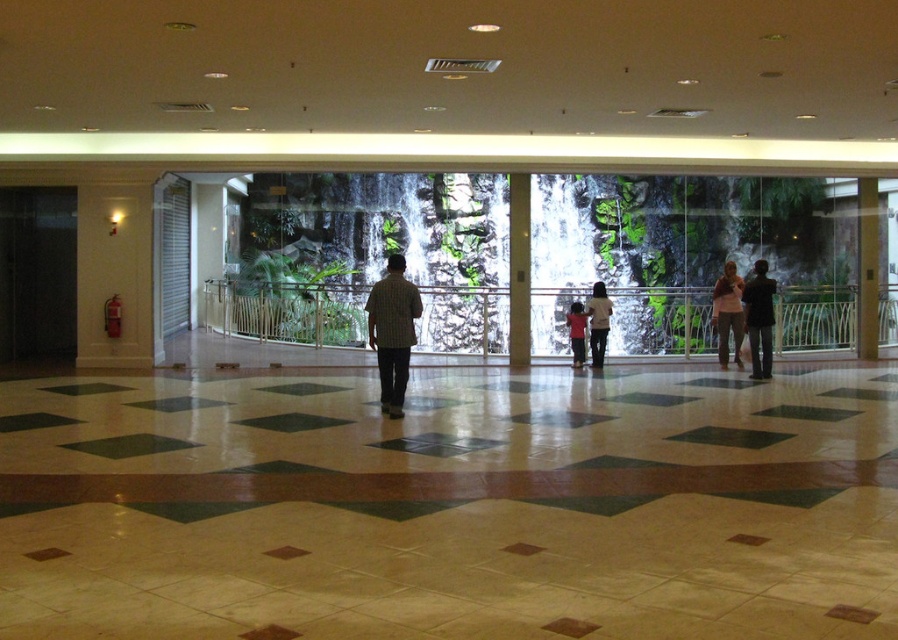
Question: From the image, what is the correct spatial relationship of green stone pillar at center in relation to light pink fabric dress at center?

Choices:
 (A) above
 (B) below

Answer: (A)

Question: Does brown wood pillar at right appear on the right side of matte pink shirt at right?

Choices:
 (A) yes
 (B) no

Answer: (A)

Question: Which is farther from the green leafy water at center?

Choices:
 (A) brown wood pillar at right
 (B) light pink fabric dress at center
 (C) plaid shirt at center
 (D) green marble floor at center

Answer: (C)

Question: Is green marble floor at center positioned behind dark brown leather jacket at right?

Choices:
 (A) no
 (B) yes

Answer: (A)

Question: Which is nearer to the green leafy water at center?

Choices:
 (A) light pink fabric dress at center
 (B) brown wood pillar at right
 (C) green stone pillar at center

Answer: (C)

Question: Which object is closer to the camera taking this photo?

Choices:
 (A) green marble floor at center
 (B) green stone pillar at center
 (C) light pink fabric dress at center
 (D) matte pink shirt at right

Answer: (A)